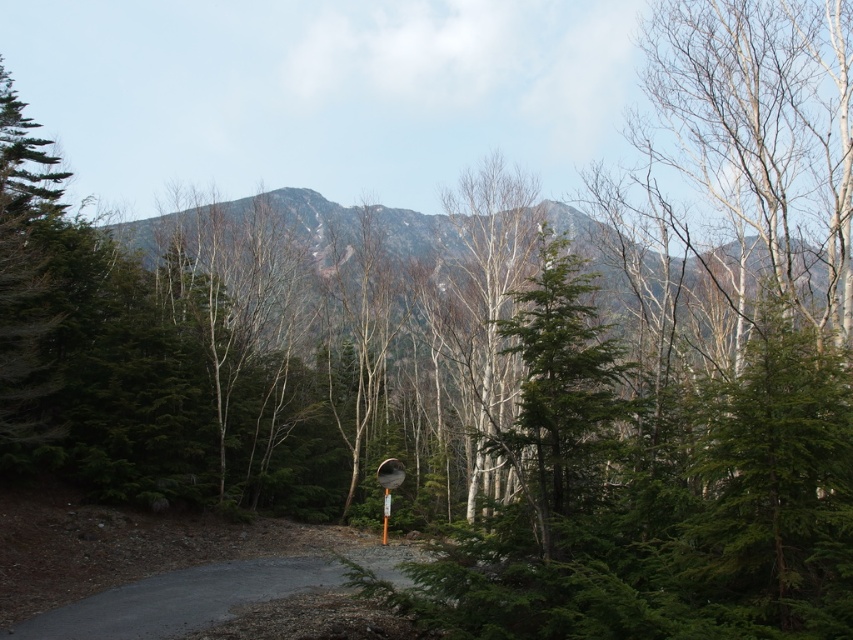
You are driving along the gray asphalt road at center and see a point marked at coordinates (x=215, y=604). Is this point located on the road?

Yes, the point at coordinates (x=215, y=604) corresponds to the gray asphalt road at center, so it is located on the road.

You are a hiker planning to take a photo of the gray rocky mountain at center from a specific location. If you want to ensure the mountain is centered in your photo, where should you position yourself relative to the mountain?

To center the gray rocky mountain at center in your photo, you should position yourself directly in front of it along the line of sight that aligns with the mountain.

You are driving along the gray asphalt road at center and see the gray rocky mountain at center in the distance. Which object is lower in elevation?

The gray asphalt road at center is below the gray rocky mountain at center, so the gray asphalt road at center is lower in elevation.